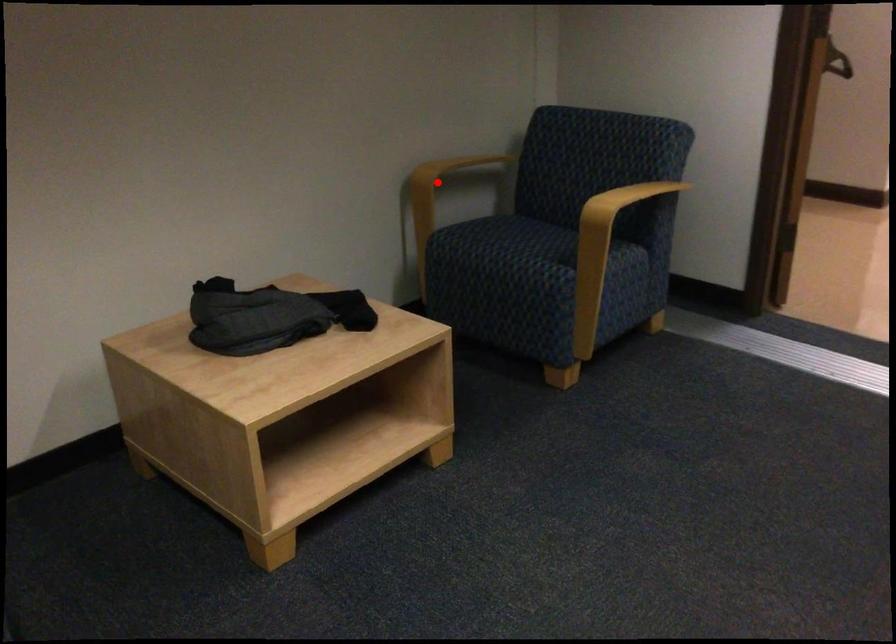
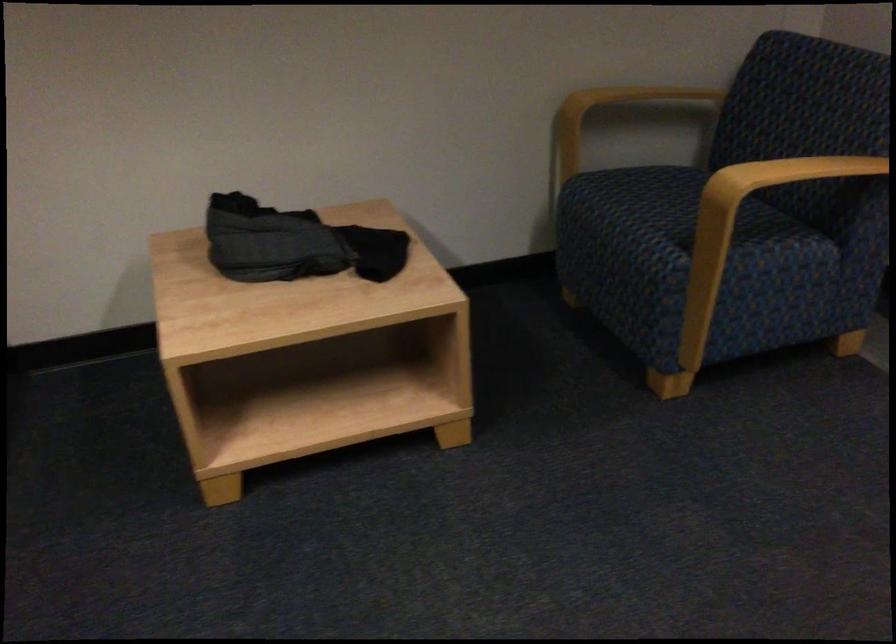
Question: I am providing you with two images of the same scene from different viewpoints. Given a red point in image1, look at the same physical point in image2. Is it:

Choices:
 (A) Closer to the viewpoint
 (B) Farther from the viewpoint

Answer: (A)